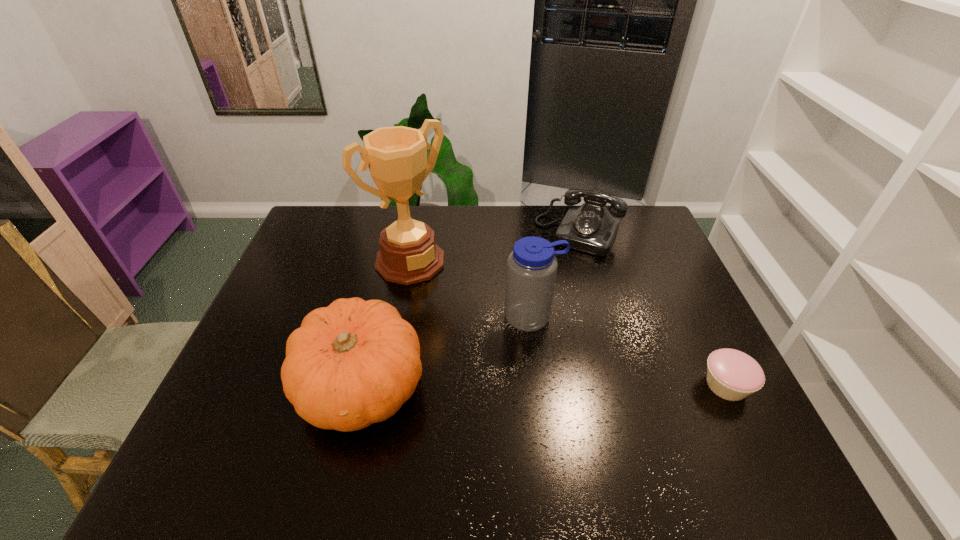
Where is `pumpkin that is at the near edge`? The height and width of the screenshot is (540, 960). pumpkin that is at the near edge is located at coordinates (354, 363).

In order to click on cupcake that is at the near edge in this screenshot , I will do `click(733, 375)`.

Find the location of a particular element. The height and width of the screenshot is (540, 960). cupcake that is at the right edge is located at coordinates (733, 375).

The image size is (960, 540). Find the location of `telephone located in the right edge section of the desktop`. telephone located in the right edge section of the desktop is located at coordinates (590, 228).

Find the location of `object that is at the far right corner`. object that is at the far right corner is located at coordinates pyautogui.click(x=590, y=228).

In order to click on object that is at the near right corner in this screenshot , I will do `click(733, 375)`.

In the image, there is a desktop. Where is `vacant space at the near edge`? The width and height of the screenshot is (960, 540). vacant space at the near edge is located at coordinates [479, 405].

Where is `vacant point at the left edge`? vacant point at the left edge is located at coordinates (308, 252).

What are the coordinates of `free space at the right edge of the desktop` in the screenshot? It's located at (657, 315).

This screenshot has width=960, height=540. What are the coordinates of `vacant space at the far left corner` in the screenshot? It's located at (339, 240).